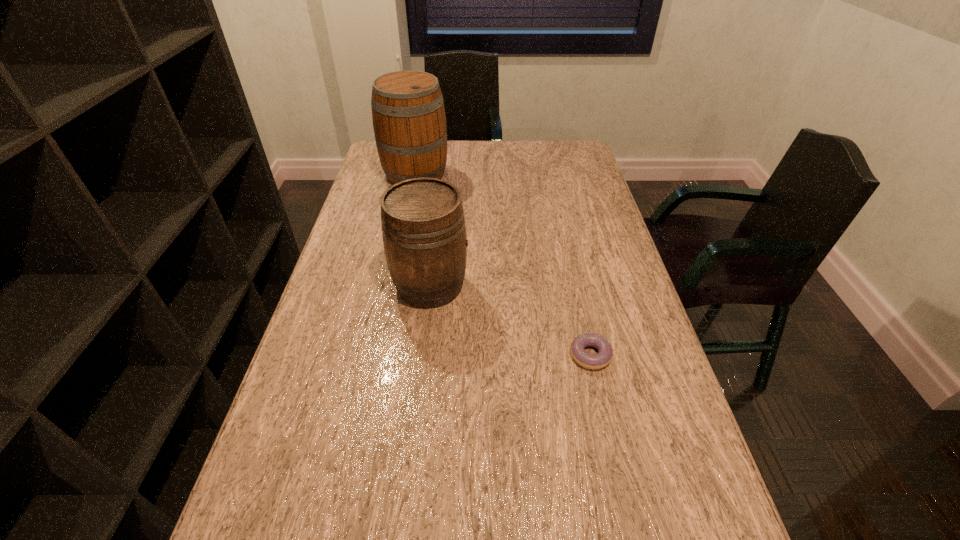
The image size is (960, 540). What are the coordinates of `the taller cider` in the screenshot? It's located at (408, 113).

Find the location of `the farthest object`. the farthest object is located at coordinates (408, 113).

The width and height of the screenshot is (960, 540). What are the coordinates of `the second shortest object` in the screenshot? It's located at (423, 227).

You are a GUI agent. You are given a task and a screenshot of the screen. Output one action in this format:
    pyautogui.click(x=<x>, y=<y>)
    Task: Click on the nearer cider
    Image resolution: width=960 pixels, height=540 pixels.
    Given the screenshot: What is the action you would take?
    pyautogui.click(x=423, y=227)

Where is `doughnut`? The width and height of the screenshot is (960, 540). doughnut is located at coordinates (604, 356).

In order to click on the rightmost object in this screenshot , I will do `click(604, 356)`.

Find the location of a particular element. The height and width of the screenshot is (540, 960). vacant space located on the back of the farthest object is located at coordinates (422, 140).

Identify the location of vacant area situated on the side of the shorter cider near the bung hole. The image size is (960, 540). (x=600, y=286).

Where is `vacant space situated on the back of the nearest object`? This screenshot has height=540, width=960. vacant space situated on the back of the nearest object is located at coordinates (570, 267).

Image resolution: width=960 pixels, height=540 pixels. In order to click on object present at the far edge in this screenshot , I will do `click(408, 113)`.